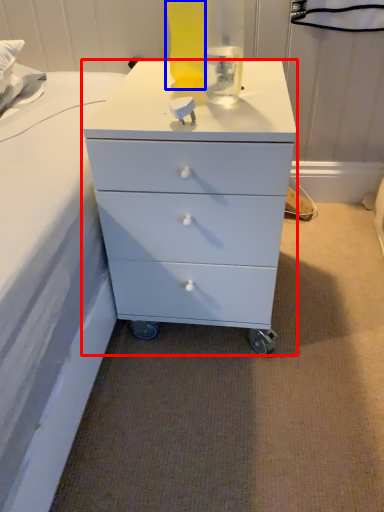
Question: Which object appears closest to the camera in this image, chest of drawers (highlighted by a red box) or bottle (highlighted by a blue box)?

Choices:
 (A) chest of drawers
 (B) bottle

Answer: (A)